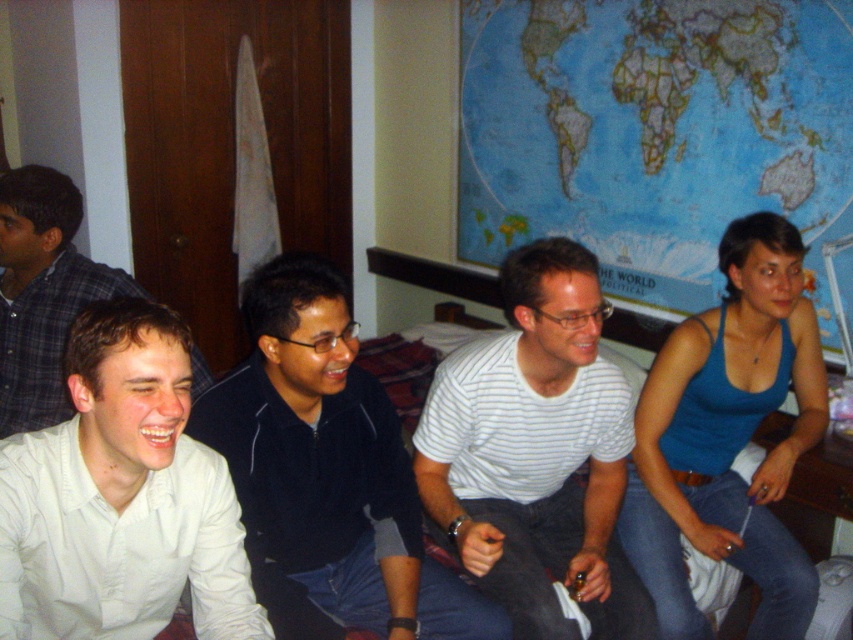
You are standing in the room and want to place a small plant between the two points, point (421, 525) and point (751, 365). Which point should the plant be closer to in order to be nearer to the viewer?

The plant should be placed closer to point (421, 525) because it is closer to the viewer than point (751, 365).

Based on the scene description, which individual is shorter between the white shirt at center and the blue tank top at right?

The white shirt at center is shorter than the blue tank top at right.